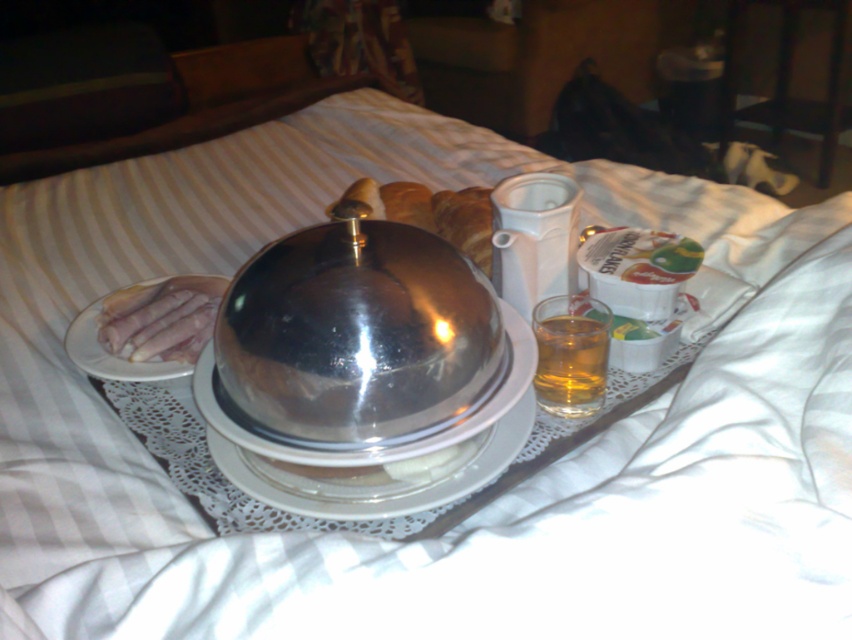
Between pinkish raw meat at left and translucent glass cup at center, which one is positioned higher?

pinkish raw meat at left is above.

Is point (105, 317) positioned before point (586, 323)?

No, (105, 317) is further to viewer.

The width and height of the screenshot is (852, 640). What are the coordinates of `pinkish raw meat at left` in the screenshot? It's located at (160, 317).

At what (x,y) coordinates should I click in order to perform the action: click on pinkish raw meat at left. Please return your answer as a coordinate pair (x, y). Looking at the image, I should click on (160, 317).

In the scene shown: Can you confirm if clear glass plate at center is positioned below pinkish raw meat at left?

Yes, clear glass plate at center is below pinkish raw meat at left.

Which is behind, point (378, 509) or point (199, 337)?

The point (199, 337) is more distant.

Identify the location of clear glass plate at center. (377, 474).

Can you confirm if clear glass plate at center is positioned to the right of translucent glass cup at center?

In fact, clear glass plate at center is to the left of translucent glass cup at center.

Is point (289, 472) positioned behind point (544, 387)?

No.

This screenshot has width=852, height=640. Describe the element at coordinates (377, 474) in the screenshot. I see `clear glass plate at center` at that location.

This screenshot has height=640, width=852. What are the coordinates of `clear glass plate at center` in the screenshot? It's located at (377, 474).